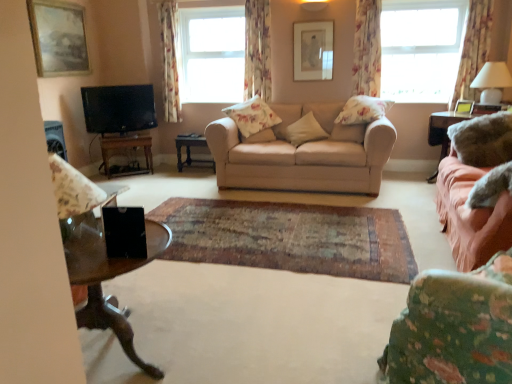
This screenshot has height=384, width=512. Identify the location of unoccupied area in front of rug at center. pyautogui.click(x=260, y=304).